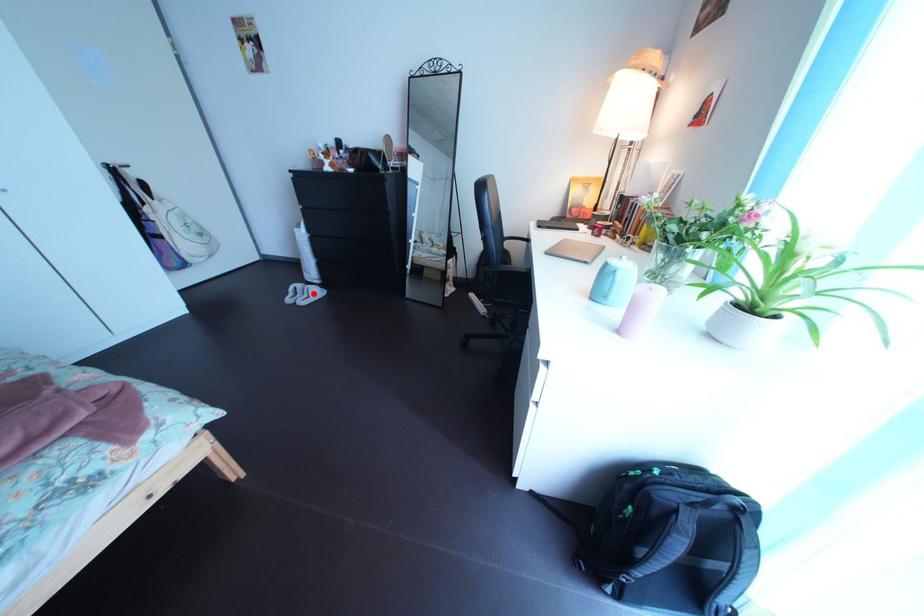
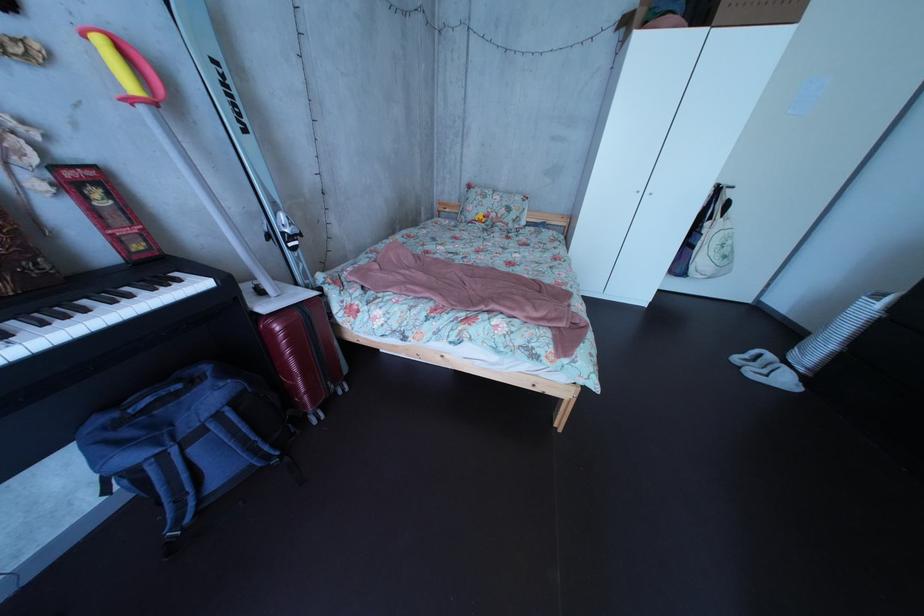
Question: I am providing you with two images of the same scene from different viewpoints. In image1, a red point is highlighted. Considering the same 3D point in image2, which of the following is correct?

Choices:
 (A) It is closer
 (B) It is farther

Answer: (B)